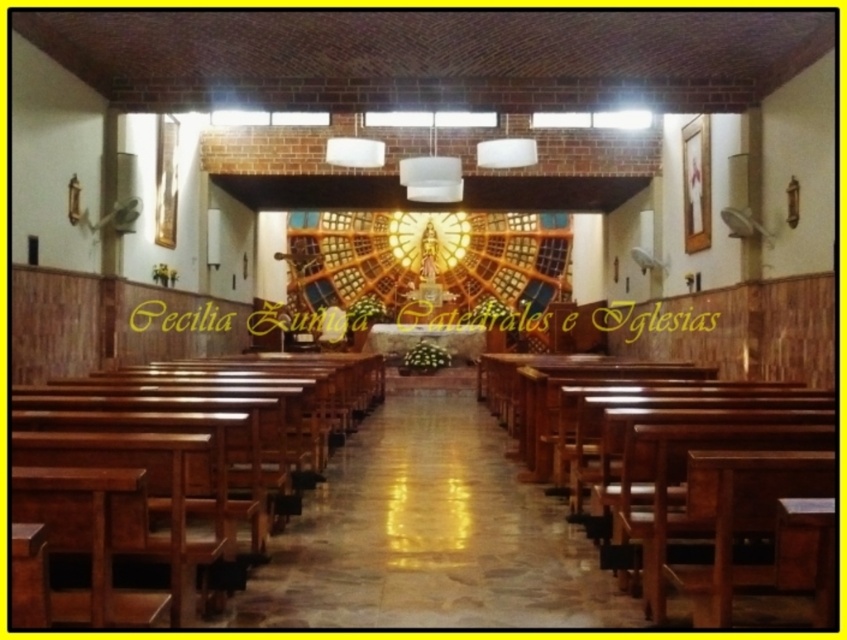
Can you confirm if wooden church bench at center is shorter than polished wood church bench at center?

No, wooden church bench at center is not shorter than polished wood church bench at center.

Does wooden church bench at center have a greater height compared to polished wood church bench at center?

Yes, wooden church bench at center is taller than polished wood church bench at center.

Is point (17, 428) more distant than point (560, 394)?

No, it is in front of (560, 394).

Locate an element on the screen. wooden church bench at center is located at coordinates (156, 481).